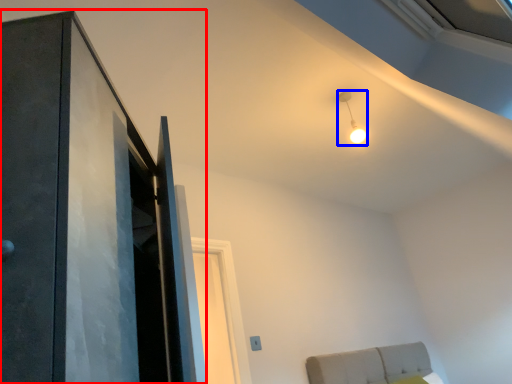
Question: Which of the following is the closest to the observer, door (highlighted by a red box) or light (highlighted by a blue box)?

Choices:
 (A) door
 (B) light

Answer: (A)